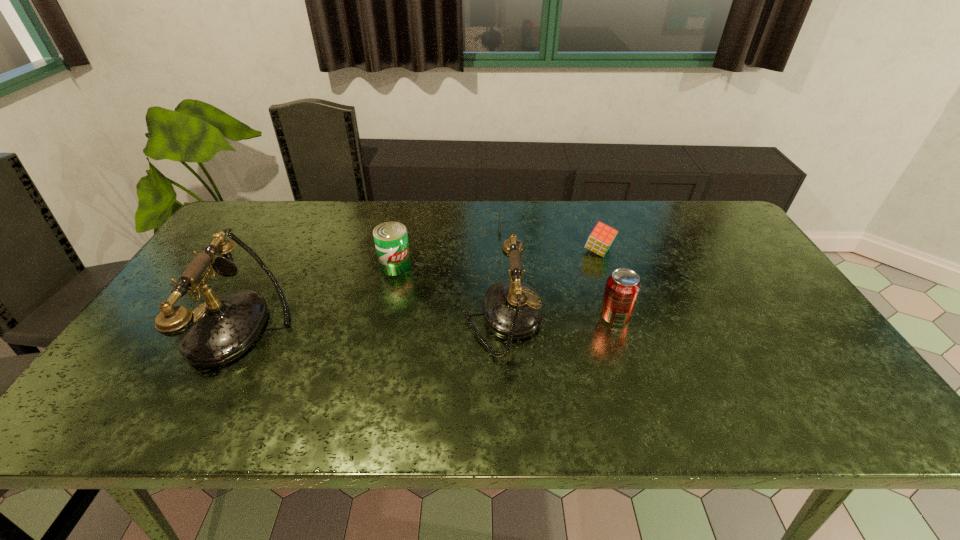
Find the location of a particular element. The width and height of the screenshot is (960, 540). empty space between the taller telephone and the soda can is located at coordinates (430, 320).

Identify the location of free space between the can and the right telephone. (449, 292).

Locate an element on the screen. free spot between the shortest object and the soda can is located at coordinates (564, 271).

Where is `vacant area that lies between the leftmost object and the can`? vacant area that lies between the leftmost object and the can is located at coordinates (321, 295).

Locate an element on the screen. This screenshot has width=960, height=540. vacant area between the right telephone and the fifth tallest object is located at coordinates (550, 285).

Identify the location of vacant space that is in between the farthest object and the right telephone. The image size is (960, 540). (507, 272).

This screenshot has height=540, width=960. I want to click on object that ranks as the third closest to the leftmost object, so click(x=512, y=208).

Locate which object ranks third in proximity to the second shortest object. Please provide its 2D coordinates. Your answer should be formatted as a tuple, i.e. [(x, y)], where the tuple contains the x and y coordinates of a point satisfying the conditions above.

[(623, 286)]

Identify the location of blank space that satisfies the following two spatial constraints: 1. on the front side of the fifth tallest object; 2. on the dial of the fifth shortest object. Image resolution: width=960 pixels, height=540 pixels. pos(621,319).